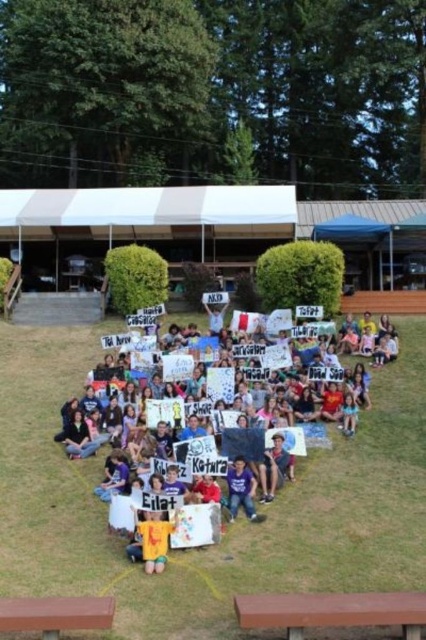
Question: Considering the relative positions of brown wood picnic table at lower center and brown wood picnic table at lower left in the image provided, where is brown wood picnic table at lower center located with respect to brown wood picnic table at lower left?

Choices:
 (A) above
 (B) below

Answer: (B)

Question: Which point appears farthest from the camera in this image?

Choices:
 (A) (385, 598)
 (B) (100, 413)
 (C) (100, 625)
 (D) (241, 468)

Answer: (B)

Question: Which of these objects is positioned closest to the purple cotton shirt at center?

Choices:
 (A) multicolored paper signs at center
 (B) brown wood picnic table at lower center
 (C) brown wood picnic table at lower left

Answer: (A)

Question: Can you confirm if multicolored paper signs at center is positioned above brown wood picnic table at lower left?

Choices:
 (A) no
 (B) yes

Answer: (B)

Question: Which object is positioned closest to the brown wood picnic table at lower left?

Choices:
 (A) multicolored paper signs at center
 (B) purple cotton shirt at center
 (C) brown wood picnic table at lower center

Answer: (C)

Question: Is multicolored paper signs at center closer to the viewer compared to brown wood picnic table at lower center?

Choices:
 (A) no
 (B) yes

Answer: (A)